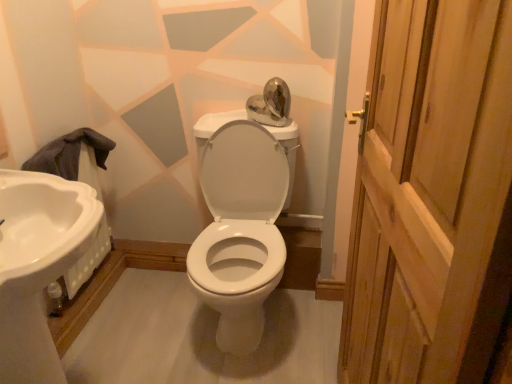
Question: From the image's perspective, is white glossy porcelain at center over white glossy sink at left?

Choices:
 (A) no
 (B) yes

Answer: (B)

Question: Does white glossy porcelain at center have a lesser width compared to white glossy sink at left?

Choices:
 (A) no
 (B) yes

Answer: (A)

Question: Is the surface of white glossy porcelain at center in direct contact with white glossy sink at left?

Choices:
 (A) no
 (B) yes

Answer: (A)

Question: Does white glossy porcelain at center have a greater height compared to white glossy sink at left?

Choices:
 (A) no
 (B) yes

Answer: (B)

Question: Is white glossy porcelain at center far away from white glossy sink at left?

Choices:
 (A) yes
 (B) no

Answer: (B)

Question: Does white glossy porcelain at center have a smaller size compared to white glossy sink at left?

Choices:
 (A) yes
 (B) no

Answer: (B)

Question: From the image's perspective, is white glossy porcelain at center located above wooden door at right?

Choices:
 (A) no
 (B) yes

Answer: (B)

Question: Does white glossy porcelain at center have a lesser width compared to wooden door at right?

Choices:
 (A) no
 (B) yes

Answer: (A)

Question: Is white glossy porcelain at center at the left side of wooden door at right?

Choices:
 (A) no
 (B) yes

Answer: (B)

Question: Is white glossy porcelain at center in front of wooden door at right?

Choices:
 (A) yes
 (B) no

Answer: (B)

Question: Is the position of white glossy porcelain at center more distant than that of wooden door at right?

Choices:
 (A) yes
 (B) no

Answer: (A)

Question: Is white glossy porcelain at center looking in the opposite direction of wooden door at right?

Choices:
 (A) yes
 (B) no

Answer: (B)

Question: From a real-world perspective, is white glossy sink at left physically below white glossy porcelain at center?

Choices:
 (A) no
 (B) yes

Answer: (A)